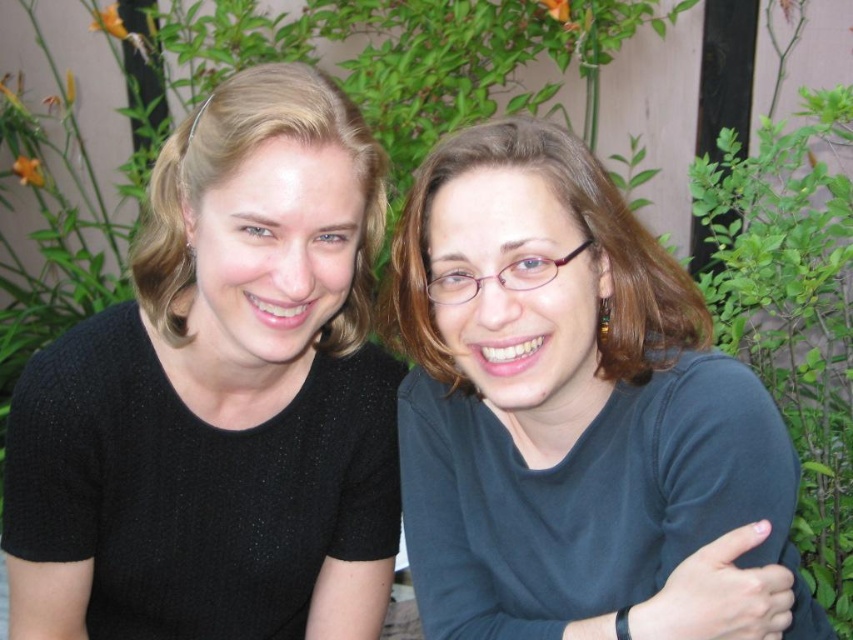
You are a photographer setting up for a portrait. You notice the black knit sweater at left and the dark blue fabric shirt at center in the scene. Which clothing item is positioned higher in the frame?

The black knit sweater at left is positioned higher in the frame than the dark blue fabric shirt at center.